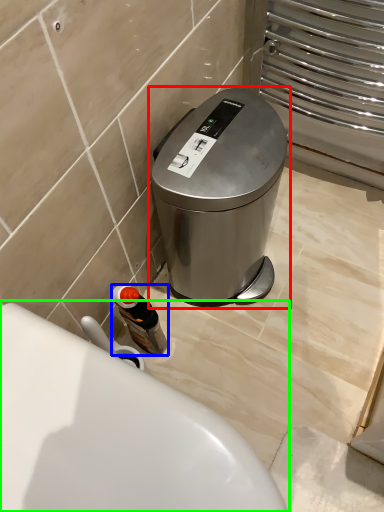
Question: Estimate the real-world distances between objects in this image. Which object is closer to waste container (highlighted by a red box), bottle (highlighted by a blue box) or toilet (highlighted by a green box)?

Choices:
 (A) bottle
 (B) toilet

Answer: (A)